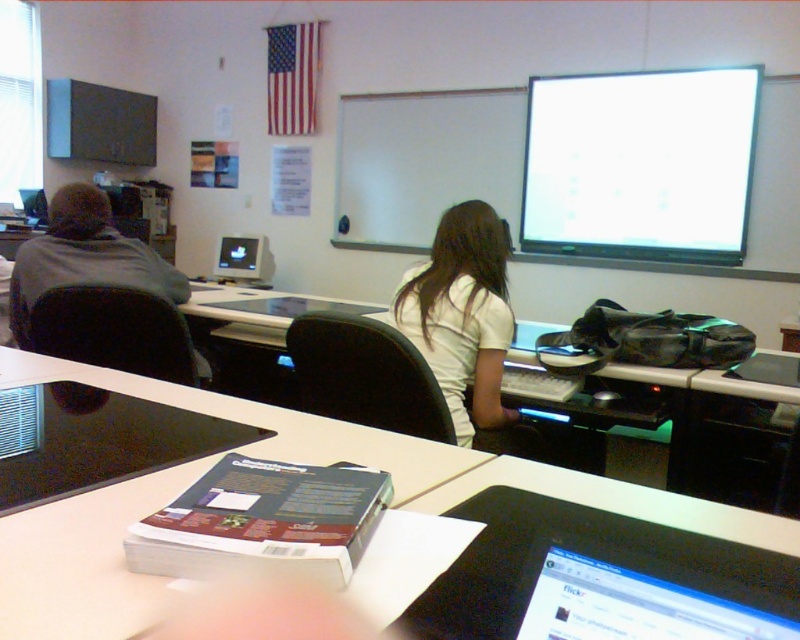
Question: Can you confirm if white matte shirt at center is thinner than matte black monitor at upper center?

Choices:
 (A) no
 (B) yes

Answer: (A)

Question: Which point is farther to the camera?

Choices:
 (A) (237, 269)
 (B) (12, 570)

Answer: (A)

Question: Estimate the real-world distances between objects in this image. Which object is closer to the white matte shirt at center?

Choices:
 (A) matte black monitor at center
 (B) white plastic computer desk at center
 (C) matte black monitor at upper center

Answer: (B)

Question: Which of the following is the closest to the observer?

Choices:
 (A) gray fabric jacket at left
 (B) black glossy laptop at lower right

Answer: (B)

Question: Does matte black monitor at center appear over matte black monitor at upper center?

Choices:
 (A) no
 (B) yes

Answer: (A)

Question: Considering the relative positions of white plastic computer desk at center and black glossy laptop at lower right in the image provided, where is white plastic computer desk at center located with respect to black glossy laptop at lower right?

Choices:
 (A) left
 (B) right

Answer: (A)